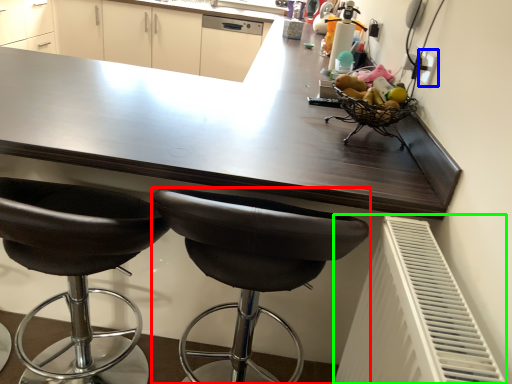
Question: Which object is positioned closest to chair (highlighted by a red box)? Select from electric outlet (highlighted by a blue box) and radiator (highlighted by a green box).

Choices:
 (A) electric outlet
 (B) radiator

Answer: (B)